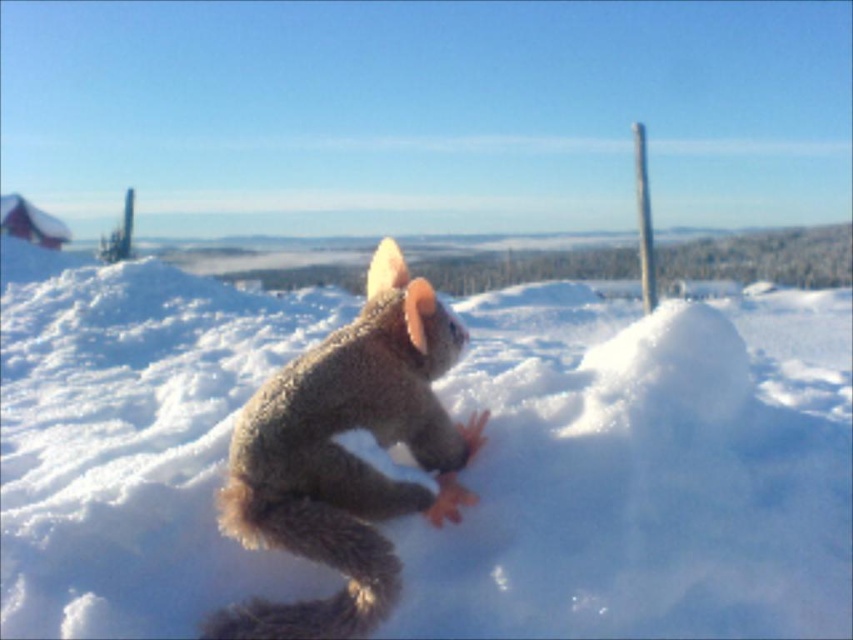
You are an observer looking at the winter scene. You notice the white fluffy snow at center and the fuzzy brown squirrel at center. Which object is located higher in the image?

The white fluffy snow at center is positioned over the fuzzy brown squirrel at center, so it is higher.

You are a photographer trying to capture the squirrel in the winter scene. You notice two points marked in the image at coordinates point (560,432) and point (309,611). Which point is closer to your camera lens?

Point (309,611) is closer to the camera lens because it is less further than point (560,432).

You are a photographer aiming to capture the white fluffy snow at center in your shot. Based on the scene description, where should you position your camera to ensure the snow is centered in the frame?

The white fluffy snow at center is located at point coordinates (643, 472), so position your camera to center the frame at those coordinates to capture the snow at the center of the image.